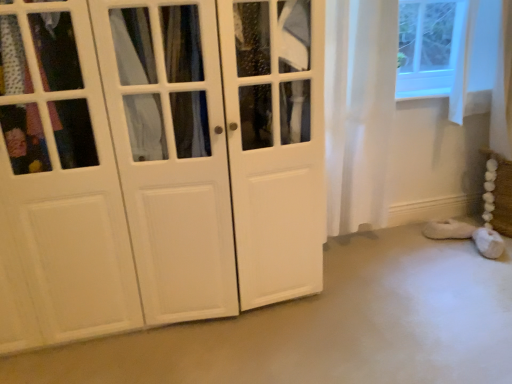
The image size is (512, 384). I want to click on free space behind white fluffy slipper at lower right, so click(x=436, y=230).